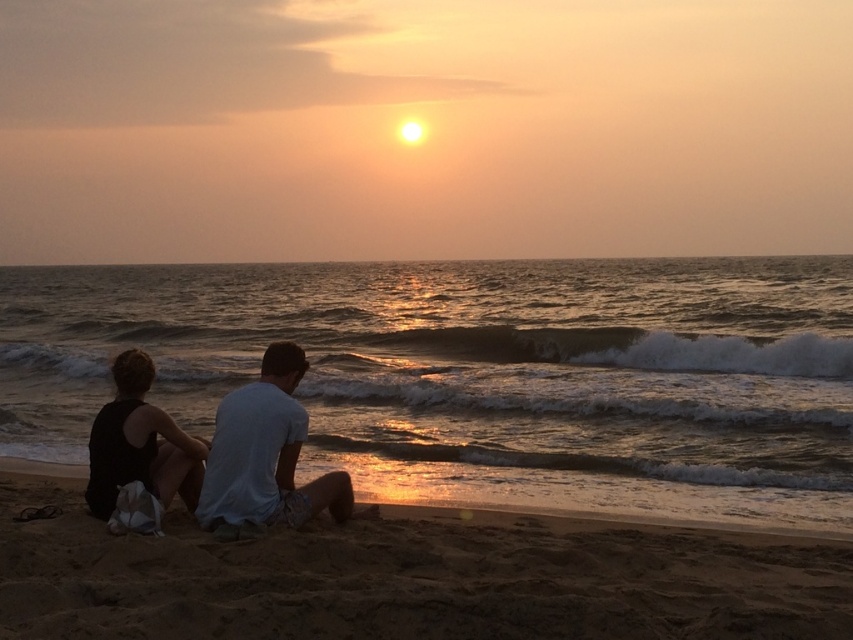
You are packing for a beach trip and want to bring both the white cotton shirt at center and the black fabric dress at lower left. If your bag can only fit one item, which one should you choose based on their sizes?

The white cotton shirt at center is larger than the black fabric dress at lower left, so you should choose the black fabric dress at lower left to fit in the bag.